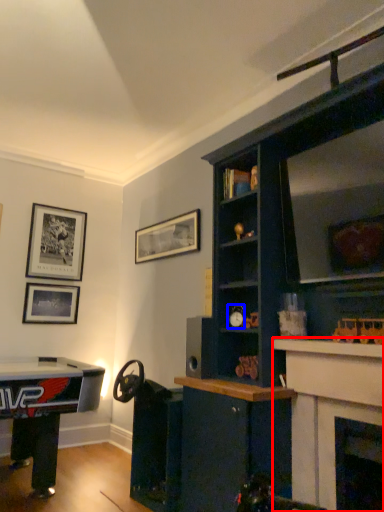
Question: Which object is further to the camera taking this photo, fireplace (highlighted by a red box) or toy (highlighted by a blue box)?

Choices:
 (A) fireplace
 (B) toy

Answer: (B)